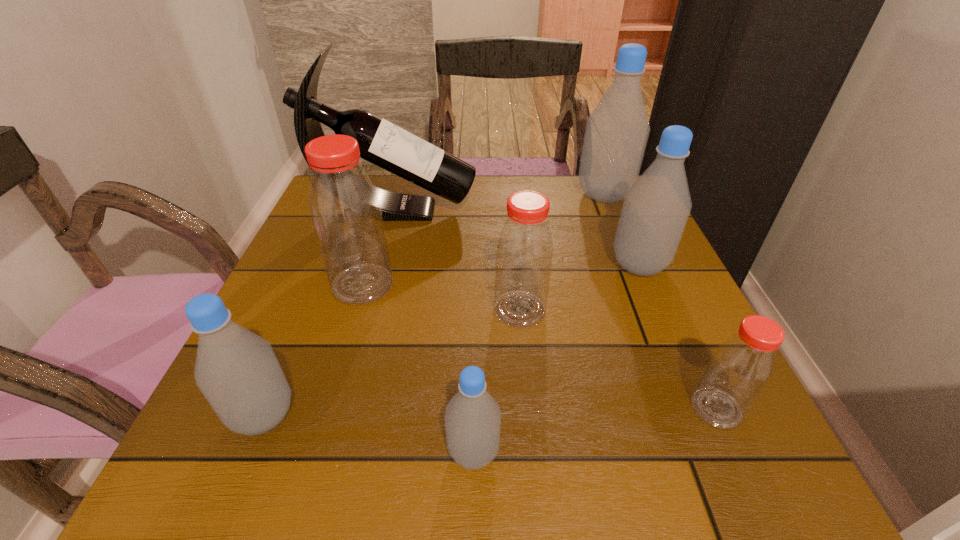
The height and width of the screenshot is (540, 960). Identify the location of bottle that is the fifth closest to the rightmost red bottle. (345, 210).

Image resolution: width=960 pixels, height=540 pixels. What are the coordinates of `gray bottle that stands as the third closest to the biggest red bottle` in the screenshot? It's located at (656, 208).

Find the location of a particular element. This screenshot has width=960, height=540. gray bottle identified as the third closest to the black wine bottle is located at coordinates (237, 371).

Find the location of a particular element. The image size is (960, 540). red bottle that is the second closest to the third gray bottle from right to left is located at coordinates (345, 210).

Where is `red bottle that is the closest to the smallest gray bottle`? This screenshot has height=540, width=960. red bottle that is the closest to the smallest gray bottle is located at coordinates (524, 251).

At what (x,y) coordinates should I click in order to perform the action: click on free space that satisfies the following two spatial constraints: 1. on the front side of the tallest bottle; 2. on the left side of the nearest red bottle. Please return your answer as a coordinate pair (x, y). The width and height of the screenshot is (960, 540). Looking at the image, I should click on (691, 408).